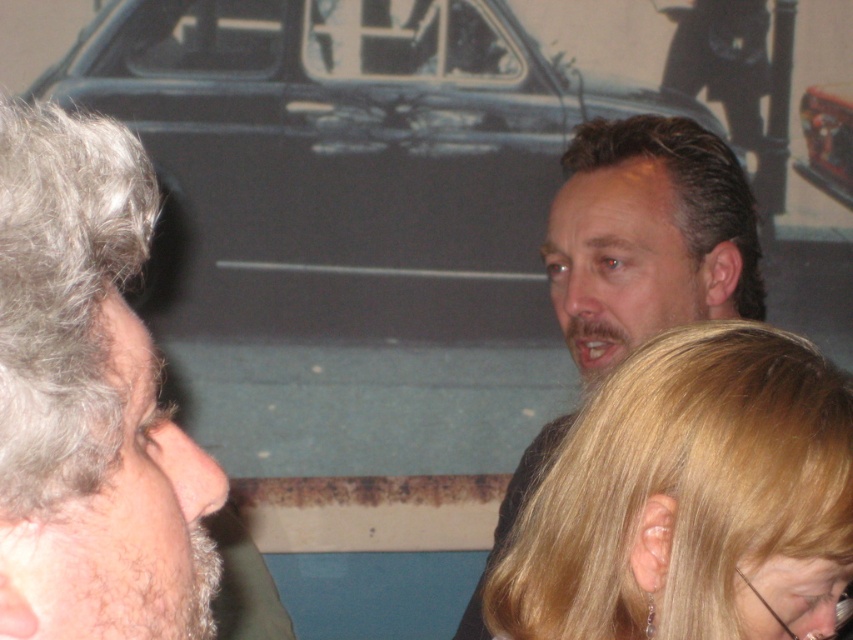
You are a photographer trying to capture a photo of the shiny metallic car at upper center without any people blocking it. Since the blonde hair at center is in the way, can you adjust your camera angle to avoid the person?

The blonde hair at center is not as tall as the shiny metallic car at upper center, so lowering the camera angle might allow you to capture the car without the person blocking it.

You are at an event and want to get a clear view of the large car display in the background. There are two people blocking your view, the blonde hair at center and the dark brown hair at center. Which person do you need to move to see the car display better?

The blonde hair at center is in front of dark brown hair at center. To get a better view of the car display, you need to move the blonde hair at center since it is closer to you and blocking the view.